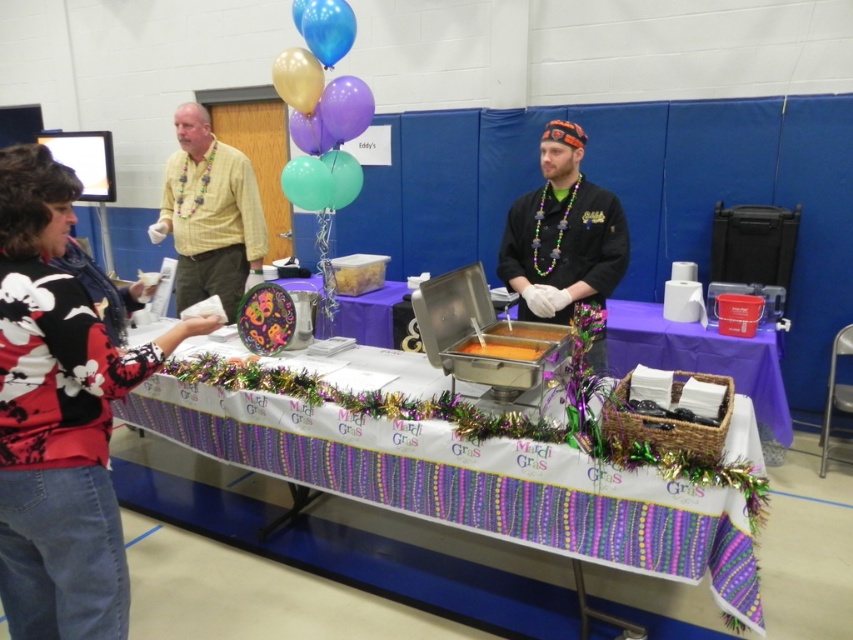
You are a guest at this Mardi Gras event and want to take a photo with the gold metallic balloon at upper center. To do so, you need to stand in front of the black chef coat at center. Is the balloon above or below the chef coat when you take the photo?

The gold metallic balloon at upper center is above the black chef coat at center because the black chef coat at center is below the gold metallic balloon at upper center.

You are a guest at the Mardi Gras party and want to place a small gift on the table. The white paper tablecloth at center and the purple matte balloon at upper center are both visible. Which object is higher from the floor?

The white paper tablecloth at center is much taller than the purple matte balloon at upper center, so the white paper tablecloth at center is higher from the floor.